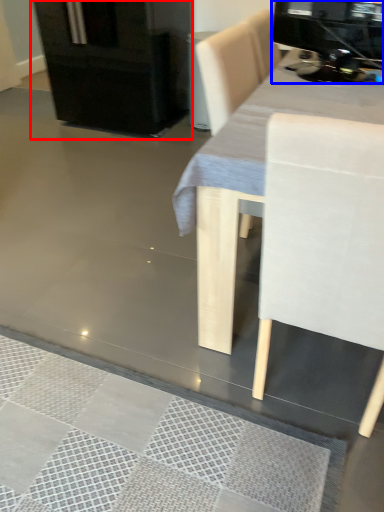
Question: Which object appears farthest to the camera in this image, fridge (highlighted by a red box) or appliance (highlighted by a blue box)?

Choices:
 (A) fridge
 (B) appliance

Answer: (A)